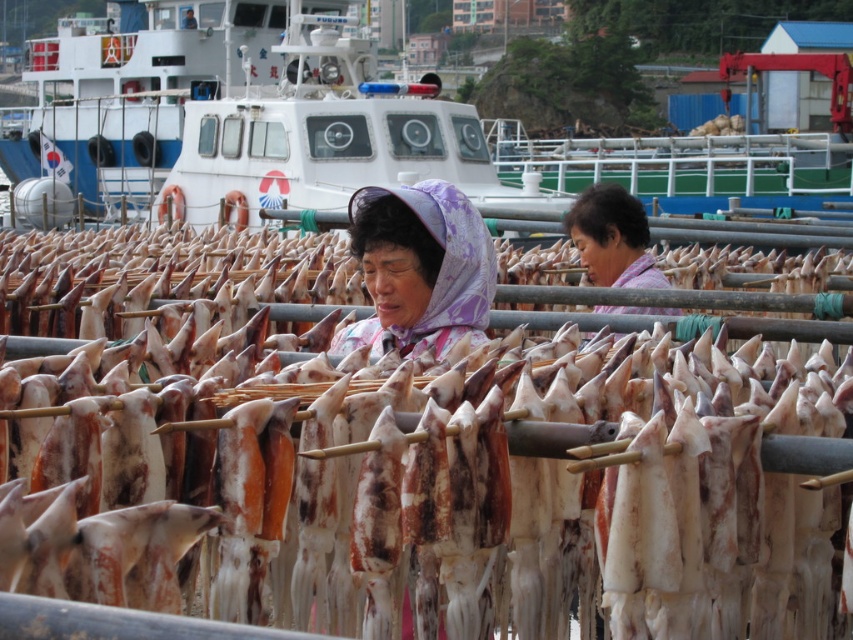
You are standing at the edge of the fishing port and see the white glossy boat at upper center and the light purple fabric headscarf at center. Which object is positioned higher in the scene?

The white glossy boat at upper center is positioned higher than the light purple fabric headscarf at center.